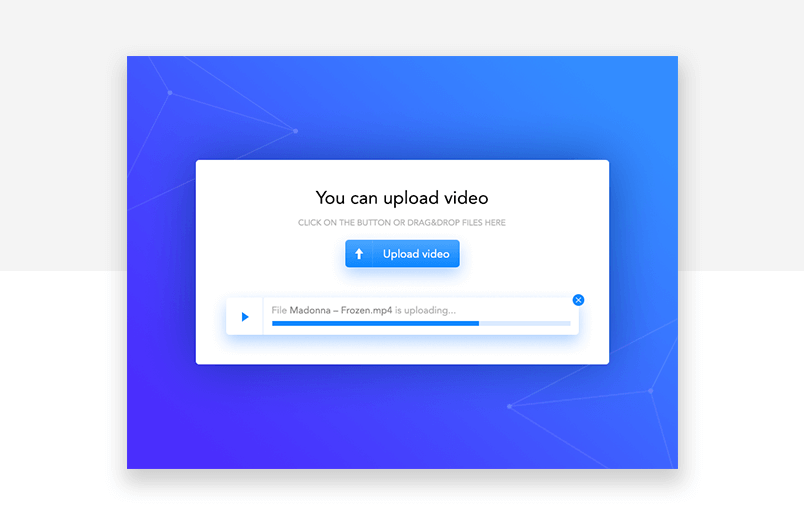
At what (x,y) coordinates should I click in order to perform the action: click on light gray bar. Please return your answer as a coordinate pair (x, y). Image resolution: width=804 pixels, height=524 pixels. Looking at the image, I should click on (523, 323).